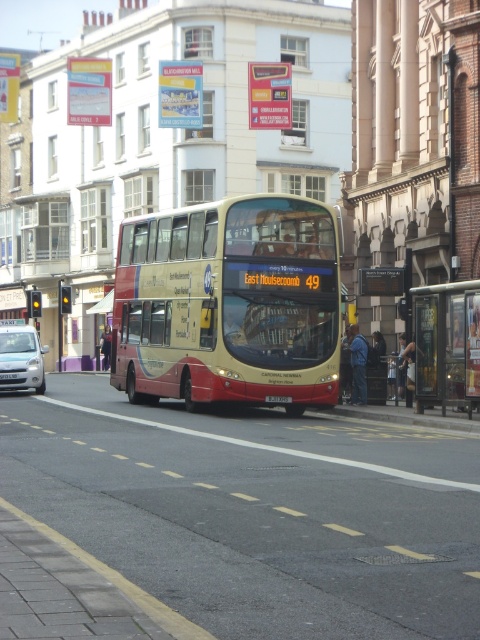
Between metallic bus stop at right and silver metallic car at left, which one appears on the left side from the viewer's perspective?

silver metallic car at left

Who is taller, metallic bus stop at right or silver metallic car at left?

metallic bus stop at right

This screenshot has width=480, height=640. Describe the element at coordinates (446, 344) in the screenshot. I see `metallic bus stop at right` at that location.

I want to click on metallic bus stop at right, so click(x=446, y=344).

Which is above, metallic bus stop at right or black plastic license plate at center?

metallic bus stop at right is above.

This screenshot has width=480, height=640. What do you see at coordinates (446, 344) in the screenshot? I see `metallic bus stop at right` at bounding box center [446, 344].

Where is `metallic bus stop at right`? The height and width of the screenshot is (640, 480). metallic bus stop at right is located at coordinates (446, 344).

Image resolution: width=480 pixels, height=640 pixels. Identify the location of metallic bus stop at right. (446, 344).

Is black plastic license plate at center taller than white plastic license plate at center?

No.

Does black plastic license plate at center lie behind white plastic license plate at center?

That is False.

Locate an element on the screen. black plastic license plate at center is located at coordinates (278, 397).